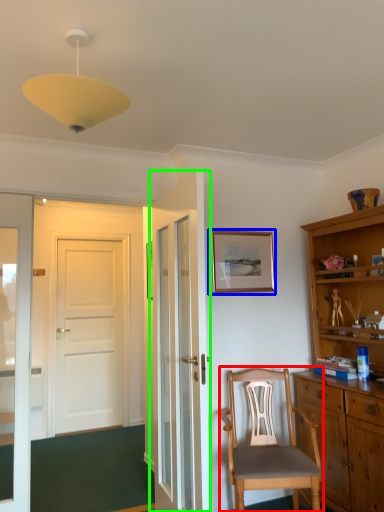
Question: Based on their relative distances, which object is farther from chair (highlighted by a red box)? Choose from picture frame (highlighted by a blue box) and door (highlighted by a green box).

Choices:
 (A) picture frame
 (B) door

Answer: (A)